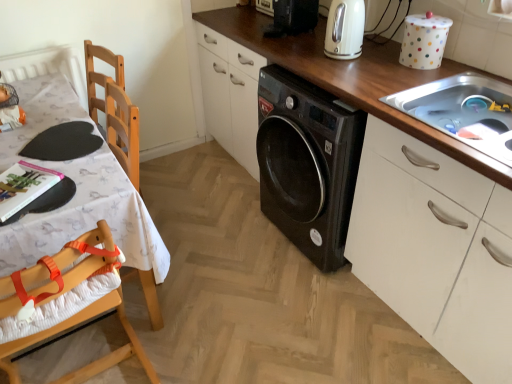
Question: Is stainless steel sink at upper right next to wooden at center?

Choices:
 (A) yes
 (B) no

Answer: (B)

Question: From the image's perspective, would you say stainless steel sink at upper right is shown under wooden at center?

Choices:
 (A) yes
 (B) no

Answer: (B)

Question: Considering the relative positions of stainless steel sink at upper right and wooden at center in the image provided, is stainless steel sink at upper right to the right of wooden at center from the viewer's perspective?

Choices:
 (A) yes
 (B) no

Answer: (A)

Question: Does stainless steel sink at upper right lie behind wooden at center?

Choices:
 (A) no
 (B) yes

Answer: (B)

Question: Is stainless steel sink at upper right not close to wooden at center?

Choices:
 (A) yes
 (B) no

Answer: (B)

Question: Can you confirm if stainless steel sink at upper right is shorter than wooden at center?

Choices:
 (A) no
 (B) yes

Answer: (B)

Question: Is wooden highchair at left touching black plastic washing machine at upper center, which ranks as the 2th appliance in front-to-back order?

Choices:
 (A) yes
 (B) no

Answer: (B)

Question: Would you say black plastic washing machine at upper center, which is counted as the first appliance, starting from the left, is part of wooden highchair at left's contents?

Choices:
 (A) yes
 (B) no

Answer: (B)

Question: Is wooden highchair at left bigger than black plastic washing machine at upper center, which ranks as the 2th appliance in front-to-back order?

Choices:
 (A) yes
 (B) no

Answer: (A)

Question: From the image's perspective, is wooden highchair at left below black plastic washing machine at upper center, the second appliance when ordered from bottom to top?

Choices:
 (A) yes
 (B) no

Answer: (A)

Question: Is wooden highchair at left positioned in front of black plastic washing machine at upper center, the second appliance when ordered from bottom to top?

Choices:
 (A) no
 (B) yes

Answer: (B)

Question: Is wooden highchair at left positioned with its back to black plastic washing machine at upper center, which is the 2th appliance from right to left?

Choices:
 (A) yes
 (B) no

Answer: (B)

Question: Is wooden at center wider than black plastic washing machine at upper center, positioned as the 1th appliance in back-to-front order?

Choices:
 (A) no
 (B) yes

Answer: (B)